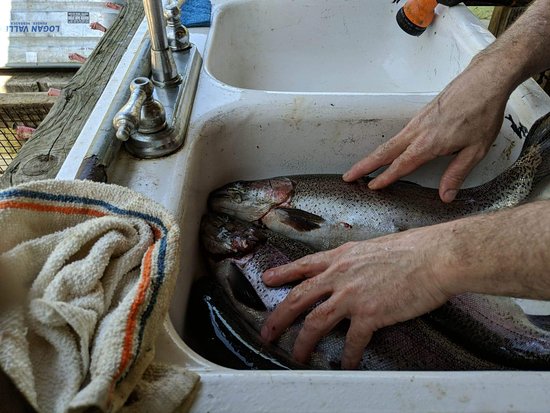
I want to click on place to turn on water, so click(126, 113), click(173, 7).